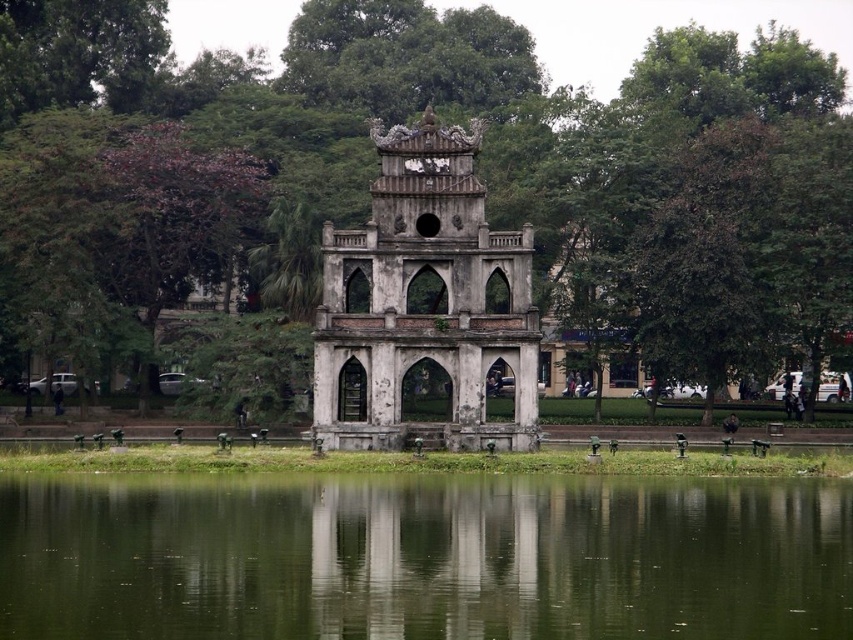
Can you confirm if green leafy tree at center is taller than green reflective water at center?

Correct, green leafy tree at center is much taller as green reflective water at center.

Between green leafy tree at center and green reflective water at center, which one appears on the left side from the viewer's perspective?

From the viewer's perspective, green reflective water at center appears more on the left side.

This screenshot has height=640, width=853. I want to click on green leafy tree at center, so click(379, 164).

Does point (836, 70) lie behind point (399, 179)?

Yes, point (836, 70) is farther from viewer.

The height and width of the screenshot is (640, 853). What do you see at coordinates (379, 164) in the screenshot? I see `green leafy tree at center` at bounding box center [379, 164].

Consider the image. Who is more distant from viewer, (664,355) or (357,349)?

Positioned behind is point (664,355).

In order to click on green leafy tree at center in this screenshot , I will do `click(379, 164)`.

Does green reflective water at center appear on the right side of white stone gazebo at center?

Incorrect, green reflective water at center is not on the right side of white stone gazebo at center.

Image resolution: width=853 pixels, height=640 pixels. What are the coordinates of `green reflective water at center` in the screenshot? It's located at (422, 557).

Between point (471, 604) and point (398, 145), which one is positioned behind?

Positioned behind is point (398, 145).

Locate an element on the screen. The width and height of the screenshot is (853, 640). green reflective water at center is located at coordinates (422, 557).